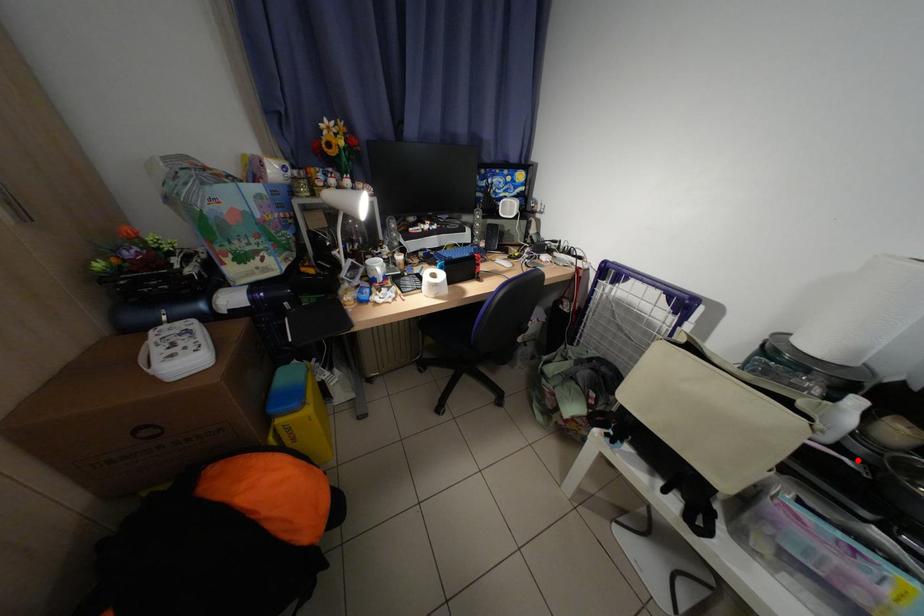
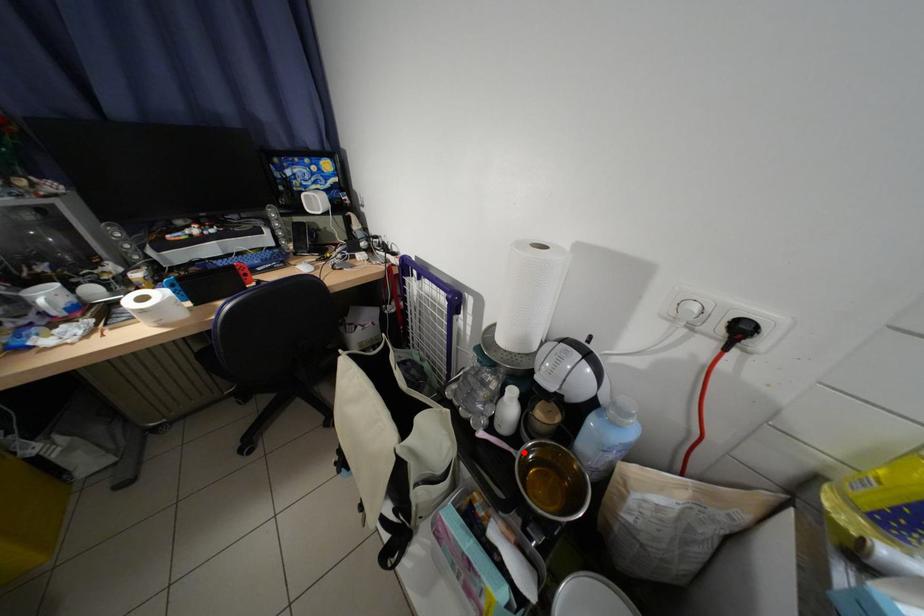
I am providing you with two images of the same scene from different viewpoints. A red point is marked on the first image and another point is marked on the second image. Is the marked point in image1 the same physical position as the marked point in image2?

Yes